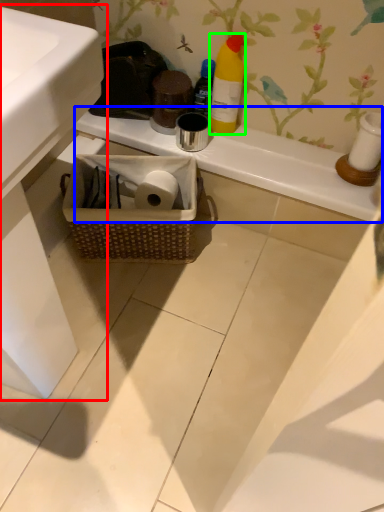
Question: Which object is positioned closest to sink (highlighted by a red box)? Select from counter top (highlighted by a blue box) and bottle (highlighted by a green box).

Choices:
 (A) counter top
 (B) bottle

Answer: (A)